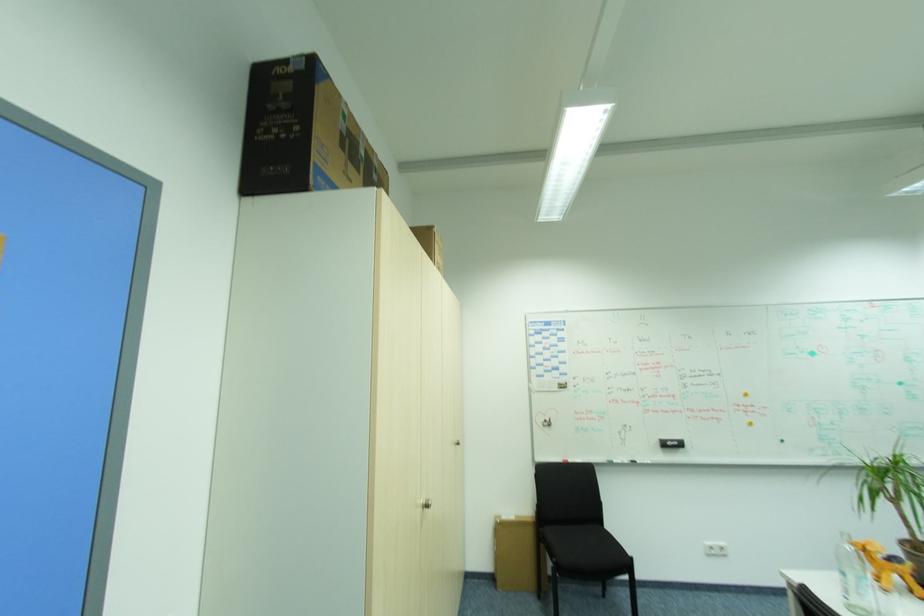
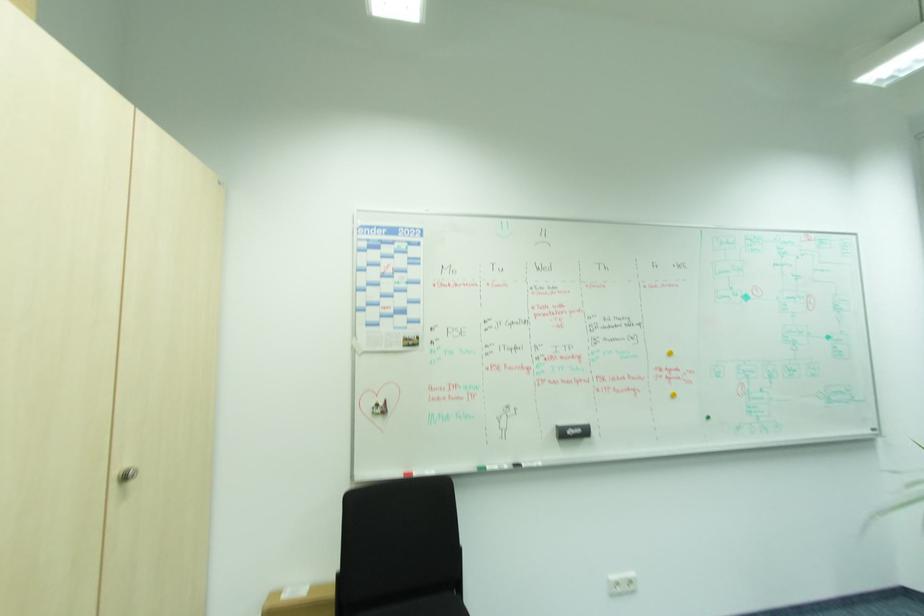
In the second image, find the point that corresponds to (572,459) in the first image.

(412, 469)